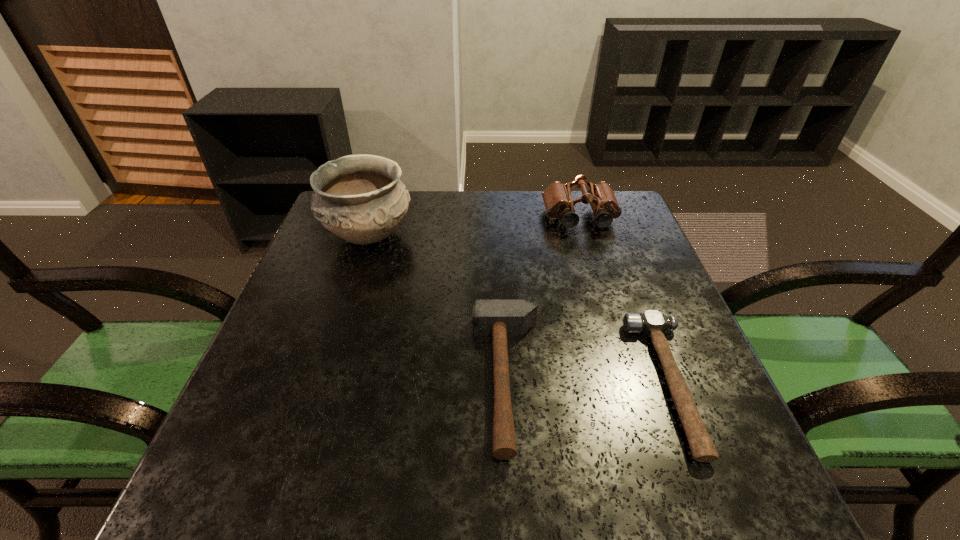
Identify the location of pottery. (360, 198).

Locate an element on the screen. The width and height of the screenshot is (960, 540). the tallest object is located at coordinates (360, 198).

Identify the location of the second tallest object. (557, 198).

Identify the location of the left hammer. (498, 318).

Identify the location of the taller hammer. This screenshot has width=960, height=540. (498, 318).

The image size is (960, 540). I want to click on the right hammer, so click(x=652, y=322).

Identify the location of the shortest object. (652, 322).

Where is `vacant space situated on the front of the leftmost object`? This screenshot has height=540, width=960. vacant space situated on the front of the leftmost object is located at coordinates [354, 277].

This screenshot has height=540, width=960. Identify the location of vacant space located 0.280m through the eyepieces of the binoculars. (607, 305).

This screenshot has width=960, height=540. I want to click on free space located on the striking surface of the taller hammer, so click(x=358, y=380).